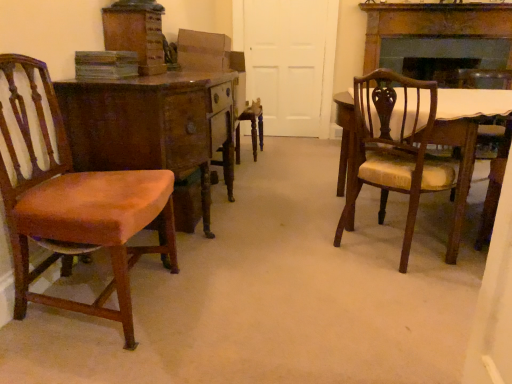
Question: Is white matte door at center at the right side of matte brown chair at left, the first chair from the left?

Choices:
 (A) yes
 (B) no

Answer: (A)

Question: Does white matte door at center have a lesser width compared to matte brown chair at left, which appears as the 2th chair when viewed from the right?

Choices:
 (A) yes
 (B) no

Answer: (A)

Question: Is matte brown chair at left, which appears as the 2th chair when viewed from the right, at the back of white matte door at center?

Choices:
 (A) no
 (B) yes

Answer: (A)

Question: Is white matte door at center wider than matte brown chair at left, the first chair from the left?

Choices:
 (A) no
 (B) yes

Answer: (A)

Question: Is white matte door at center positioned in front of matte brown chair at left, the first chair from the left?

Choices:
 (A) no
 (B) yes

Answer: (A)

Question: Considering the relative sizes of white matte door at center and matte brown chair at left, the first chair from the left, in the image provided, is white matte door at center bigger than matte brown chair at left, the first chair from the left,?

Choices:
 (A) yes
 (B) no

Answer: (B)

Question: From the image's perspective, would you say wooden desk at left is shown under matte brown chair at right, positioned as the 2th chair in left-to-right order?

Choices:
 (A) no
 (B) yes

Answer: (A)

Question: Considering the relative positions of wooden desk at left and matte brown chair at right, positioned as the 2th chair in left-to-right order, in the image provided, is wooden desk at left to the left of matte brown chair at right, positioned as the 2th chair in left-to-right order, from the viewer's perspective?

Choices:
 (A) no
 (B) yes

Answer: (B)

Question: Could you tell me if wooden desk at left is facing matte brown chair at right, positioned as the first chair in right-to-left order?

Choices:
 (A) yes
 (B) no

Answer: (A)

Question: Is matte brown chair at right, positioned as the 2th chair in left-to-right order, at the back of wooden desk at left?

Choices:
 (A) no
 (B) yes

Answer: (A)

Question: Is wooden desk at left positioned behind matte brown chair at right, positioned as the first chair in right-to-left order?

Choices:
 (A) no
 (B) yes

Answer: (B)

Question: Is wooden desk at left to the right of matte brown chair at right, positioned as the first chair in right-to-left order, from the viewer's perspective?

Choices:
 (A) yes
 (B) no

Answer: (B)

Question: From a real-world perspective, is matte brown chair at left, the first chair from the left, on top of matte brown chair at right, positioned as the first chair in right-to-left order?

Choices:
 (A) no
 (B) yes

Answer: (B)